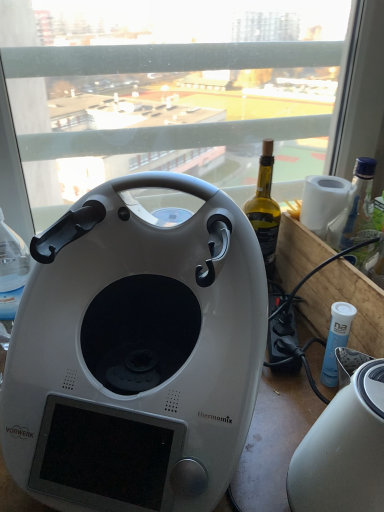
Question: From the image's perspective, does white glossy thermomix at center appear lower than transparent glass window at center?

Choices:
 (A) yes
 (B) no

Answer: (A)

Question: Is white glossy thermomix at center positioned behind transparent glass window at center?

Choices:
 (A) yes
 (B) no

Answer: (B)

Question: Does white glossy thermomix at center appear on the right side of transparent glass window at center?

Choices:
 (A) no
 (B) yes

Answer: (A)

Question: From the image's perspective, is white glossy thermomix at center located above transparent glass window at center?

Choices:
 (A) no
 (B) yes

Answer: (A)

Question: Does white glossy thermomix at center have a greater height compared to transparent glass window at center?

Choices:
 (A) no
 (B) yes

Answer: (A)

Question: From the image's perspective, is transparent glass window at center positioned above or below white glossy toaster at lower right?

Choices:
 (A) below
 (B) above

Answer: (B)

Question: In terms of size, does transparent glass window at center appear bigger or smaller than white glossy toaster at lower right?

Choices:
 (A) small
 (B) big

Answer: (B)

Question: In the image, is transparent glass window at center on the left side or the right side of white glossy toaster at lower right?

Choices:
 (A) right
 (B) left

Answer: (B)

Question: Considering the positions of point (23, 64) and point (354, 462), is point (23, 64) closer or farther from the camera than point (354, 462)?

Choices:
 (A) farther
 (B) closer

Answer: (A)

Question: Is white glossy toaster at lower right in front of or behind transparent glass window at center in the image?

Choices:
 (A) front
 (B) behind

Answer: (A)

Question: From a real-world perspective, is white glossy toaster at lower right above or below transparent glass window at center?

Choices:
 (A) below
 (B) above

Answer: (A)

Question: From the image's perspective, is white glossy toaster at lower right above or below transparent glass window at center?

Choices:
 (A) above
 (B) below

Answer: (B)

Question: Is white glossy toaster at lower right situated inside transparent glass window at center or outside?

Choices:
 (A) inside
 (B) outside

Answer: (B)

Question: Looking at their shapes, would you say white glossy thermomix at center is wider or thinner than transparent glass window at center?

Choices:
 (A) wide
 (B) thin

Answer: (A)

Question: Considering the positions of point (59, 407) and point (34, 152), is point (59, 407) closer or farther from the camera than point (34, 152)?

Choices:
 (A) closer
 (B) farther

Answer: (A)